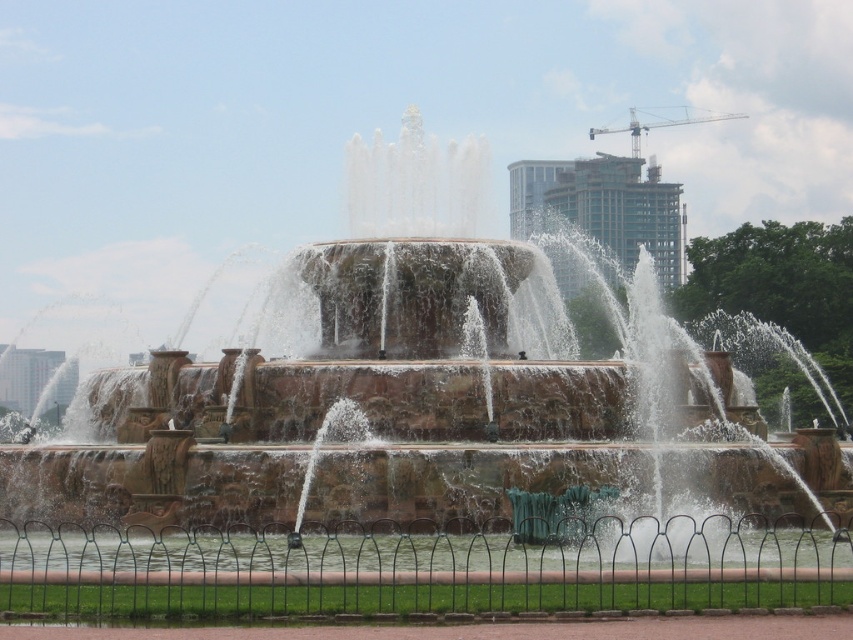
Question: Among these objects, which one is nearest to the camera?

Choices:
 (A) clear water at center
 (B) brown stone fountain at center

Answer: (A)

Question: Which object appears closest to the camera in this image?

Choices:
 (A) clear water at center
 (B) brown stone fountain at center

Answer: (A)

Question: Does brown stone fountain at center have a larger size compared to clear water at center?

Choices:
 (A) yes
 (B) no

Answer: (A)

Question: From the image, what is the correct spatial relationship of brown stone fountain at center in relation to clear water at center?

Choices:
 (A) above
 (B) below

Answer: (A)

Question: Is brown stone fountain at center to the right of clear water at center from the viewer's perspective?

Choices:
 (A) no
 (B) yes

Answer: (A)